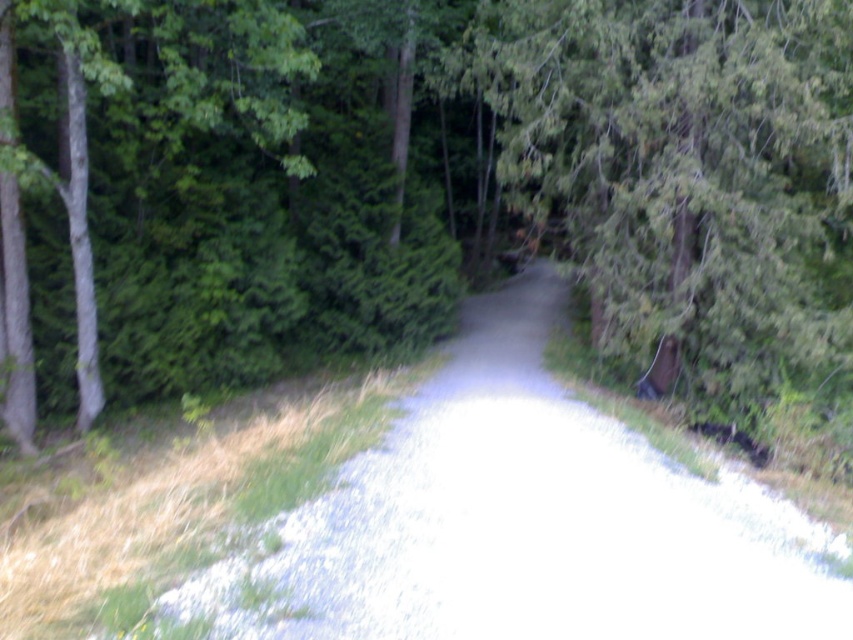
You are a hiker carrying a 2 meter long ladder. You are standing on the gray gravel trail at center and need to place the ladder horizontally in the green leafy forest at center. Can you determine if the ladder will fit without bending the trees?

The green leafy forest at center is 6.95 meters from gray gravel trail at center. Since the ladder is 2 meters long, it can be placed horizontally within the 6.95 meters distance without needing to bend the trees.

You are a hiker trying to decide whether to walk along the gray gravel trail at center or around the green textured tree at center. Which path option is wider?

The gray gravel trail at center has a larger size compared to the green textured tree at center, so the gray gravel trail at center is wider and offers a broader path for walking.

You are standing at the point with coordinates (531,522) in the forest. What is the surface you are currently standing on?

The surface at point (531,522) is the gray gravel trail at center.